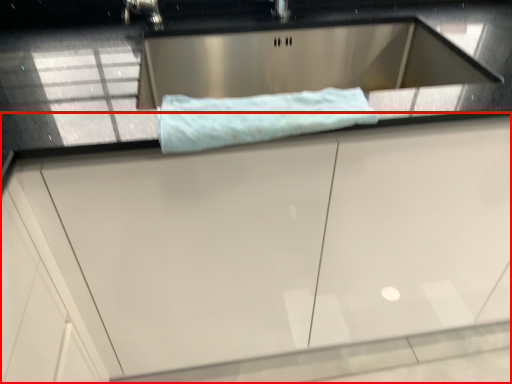
Question: From the image's perspective, what is the correct spatial relationship of cabinetry (annotated by the red box) in relation to bath towel?

Choices:
 (A) above
 (B) below

Answer: (B)